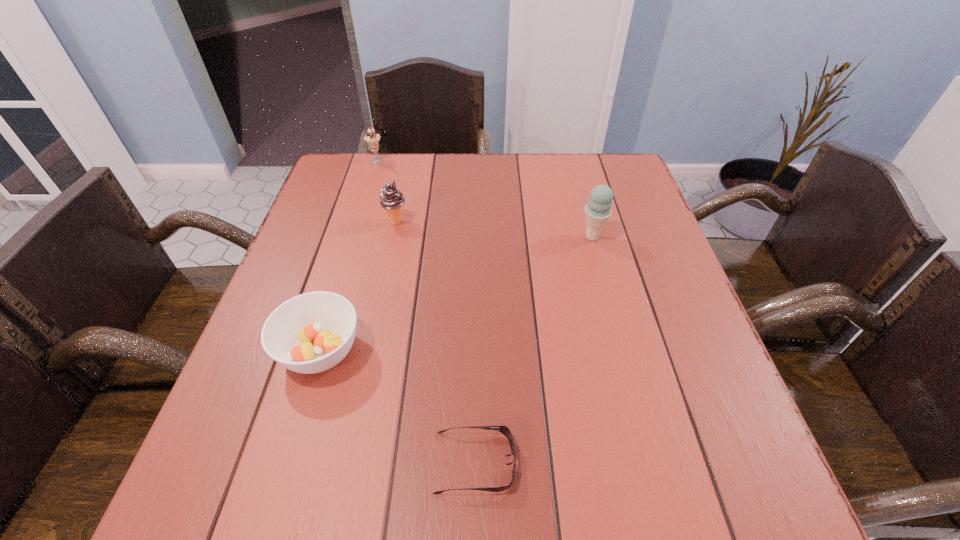
Where is `vacant area that satisfies the following two spatial constraints: 1. on the front side of the leftmost icecream; 2. on the left side of the rightmost icecream`? The height and width of the screenshot is (540, 960). vacant area that satisfies the following two spatial constraints: 1. on the front side of the leftmost icecream; 2. on the left side of the rightmost icecream is located at coordinates (353, 237).